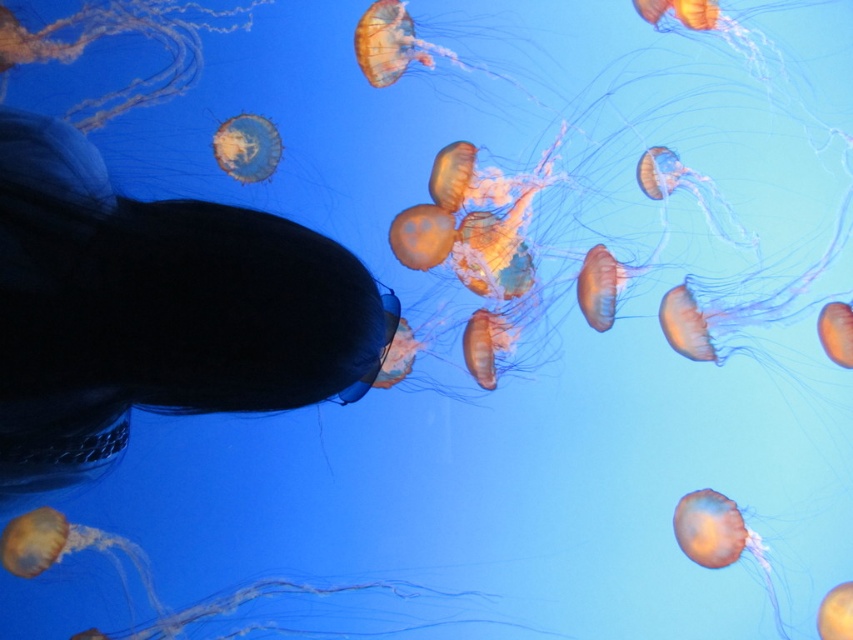
Can you confirm if translucent orange jellyfish at lower right is shorter than translucent orange jellyfish at upper center?

In fact, translucent orange jellyfish at lower right may be taller than translucent orange jellyfish at upper center.

From the picture: Is translucent orange jellyfish at lower right wider than translucent orange jellyfish at upper center?

Yes.

Where is `translucent orange jellyfish at lower right`? translucent orange jellyfish at lower right is located at coordinates (718, 538).

Find the location of a particular element. The height and width of the screenshot is (640, 853). translucent orange jellyfish at lower right is located at coordinates (718, 538).